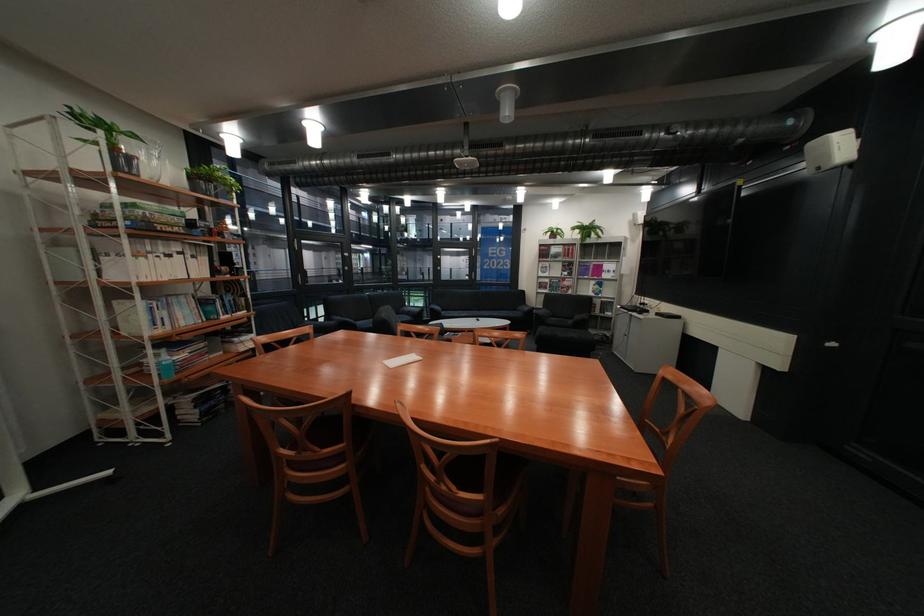
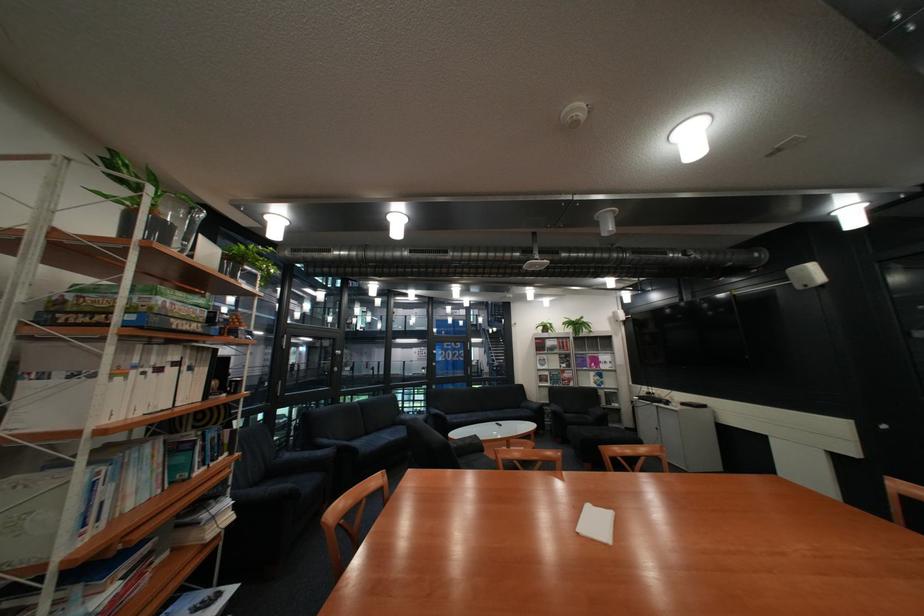
In the second image, find the point that corresponds to the point at 140,220 in the first image.

(141, 312)